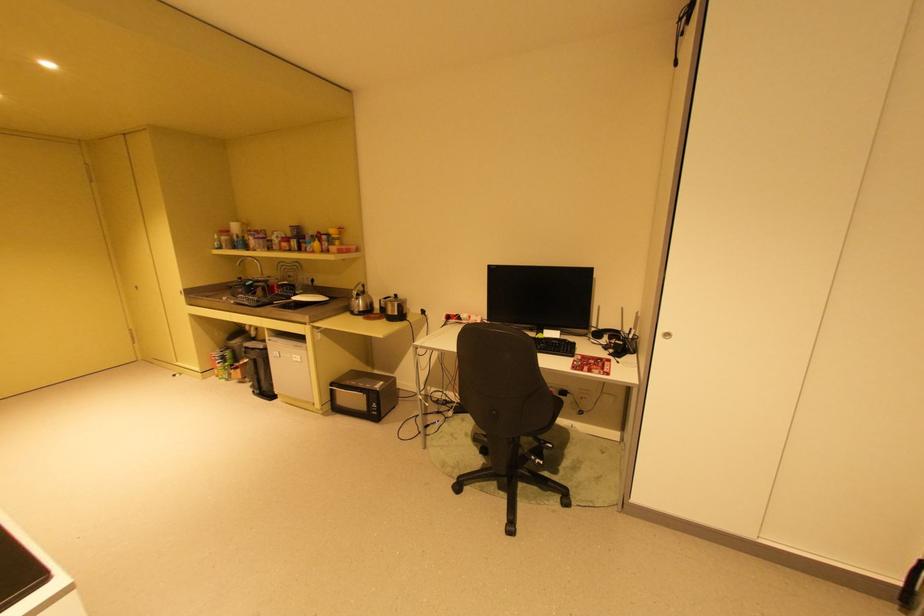
Find the location of a particular element. The image size is (924, 616). silver kettle handle is located at coordinates (359, 289).